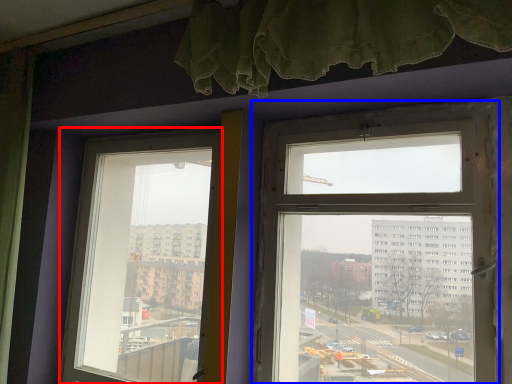
Question: Which object appears farthest to the camera in this image, window (highlighted by a red box) or window (highlighted by a blue box)?

Choices:
 (A) window
 (B) window

Answer: (A)